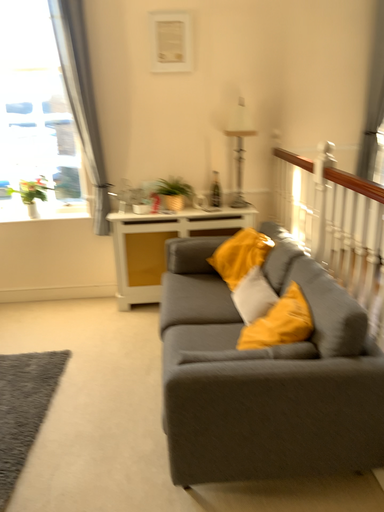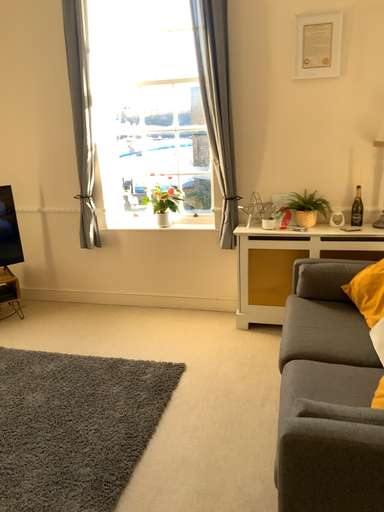
Question: Which way did the camera rotate in the video?

Choices:
 (A) rotated right
 (B) rotated left

Answer: (B)